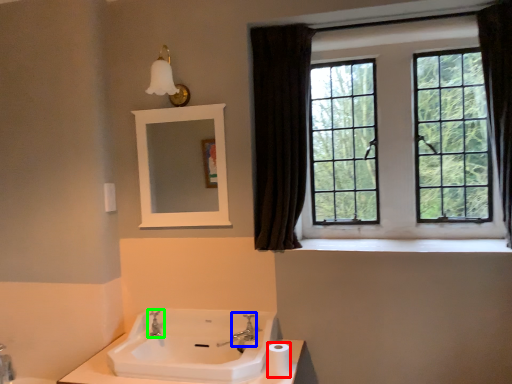
Question: Considering the real-world distances, which object is farthest from toilet paper (highlighted by a red box)? plumbing fixture (highlighted by a blue box) or tap (highlighted by a green box)?

Choices:
 (A) plumbing fixture
 (B) tap

Answer: (B)